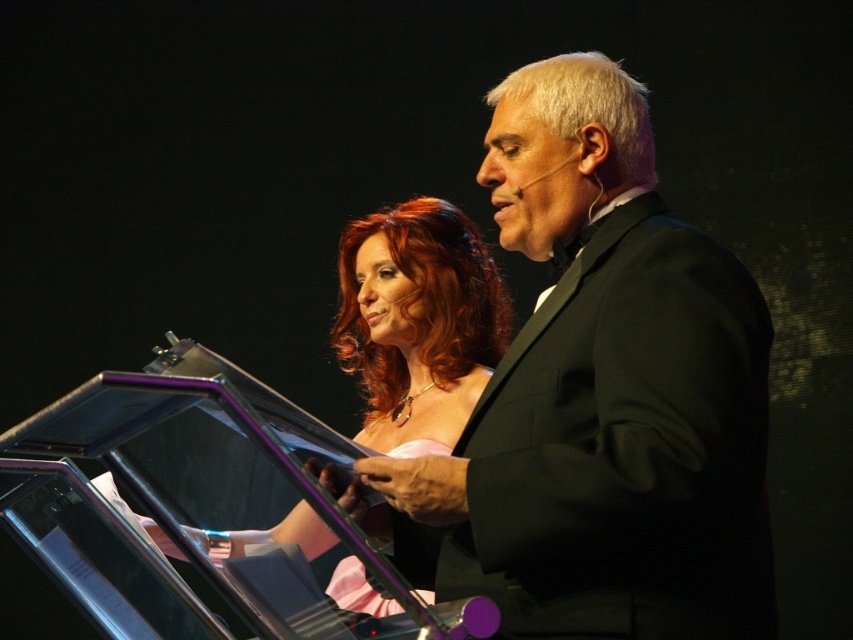
Question: Which object appears farthest from the camera in this image?

Choices:
 (A) black satin suit at center
 (B) matte pink dress at center

Answer: (B)

Question: Where is black satin suit at center located in relation to matte pink dress at center in the image?

Choices:
 (A) right
 (B) left

Answer: (A)

Question: Observing the image, what is the correct spatial positioning of black satin suit at center in reference to matte pink dress at center?

Choices:
 (A) left
 (B) right

Answer: (B)

Question: Can you confirm if black satin suit at center is smaller than matte pink dress at center?

Choices:
 (A) no
 (B) yes

Answer: (B)

Question: Which point is closer to the camera taking this photo?

Choices:
 (A) (236, 545)
 (B) (537, 138)

Answer: (B)